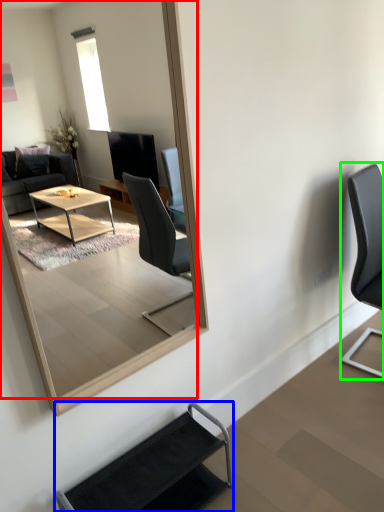
Question: Considering the real-world distances, which object is farthest from mirror (highlighted by a red box)? chair (highlighted by a blue box) or chair (highlighted by a green box)?

Choices:
 (A) chair
 (B) chair

Answer: (A)